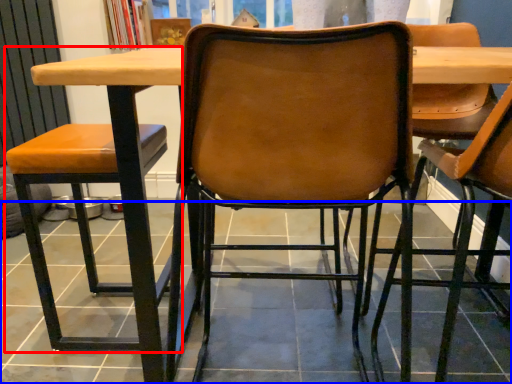
Question: Which object is further to the camera taking this photo, chair (highlighted by a red box) or tile (highlighted by a blue box)?

Choices:
 (A) chair
 (B) tile

Answer: (B)